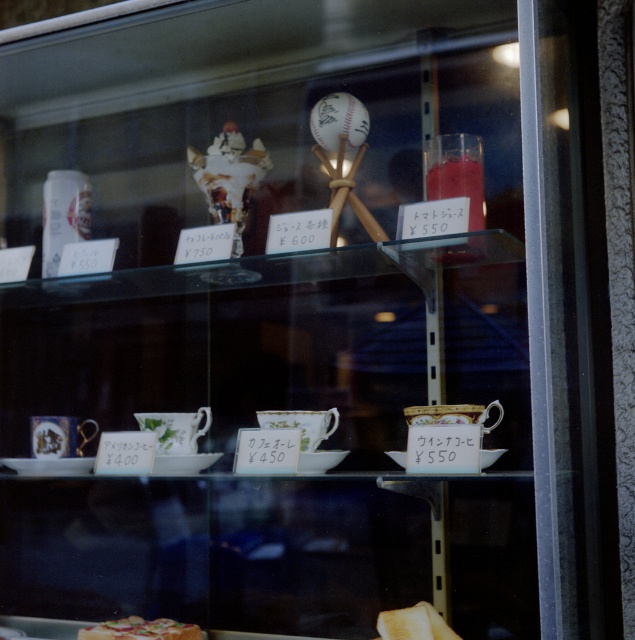
You are a delivery person who needs to pick up the shiny plastic pizza at lower center from the display case. The case is locked, but there is a service hatch on the side that is 1.25 meters wide. Can you reach the pizza through the hatch?

The distance between the shiny plastic pizza at lower center and the viewer is 1.30 meters. The service hatch is only 1.25 meters wide, so you cannot reach the pizza through the hatch.

You are a customer in the store and want to buy the shiny plastic pizza at lower center. The store requires you to point to the item using coordinates. What coordinates should you provide?

The coordinates for the shiny plastic pizza at lower center are at point (140, 628).

You are a customer looking at the display case and want to know which item is bigger between the shiny plastic pizza at lower center and the golden toasted bread at lower center. Can you tell me?

The shiny plastic pizza at lower center is larger in size than the golden toasted bread at lower center.